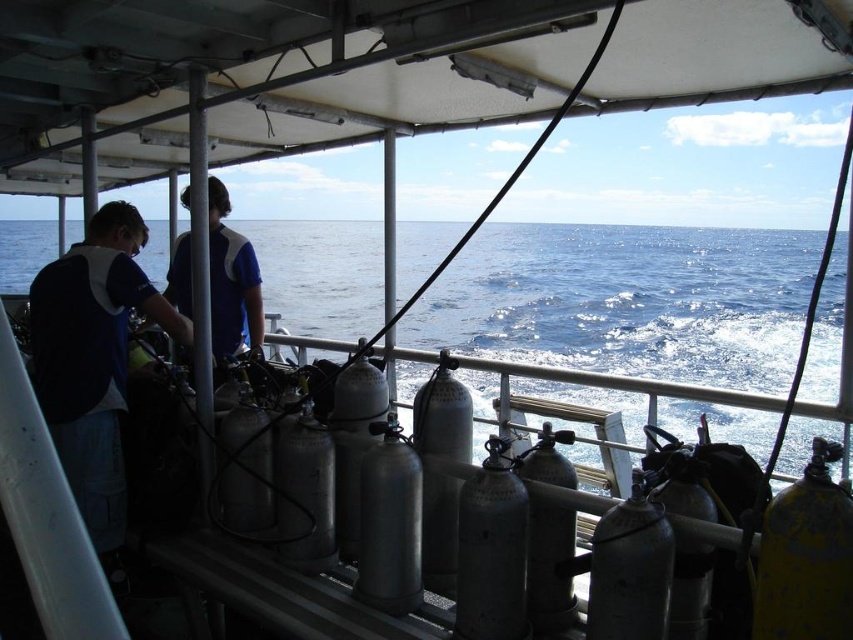
Which is behind, point (762, 452) or point (111, 291)?

Positioned behind is point (762, 452).

This screenshot has height=640, width=853. What do you see at coordinates (625, 301) in the screenshot?
I see `metallic silver water at lower center` at bounding box center [625, 301].

This screenshot has height=640, width=853. I want to click on metallic silver water at lower center, so click(625, 301).

This screenshot has height=640, width=853. In order to click on metallic silver water at lower center in this screenshot , I will do `click(625, 301)`.

Is metallic silver water at lower center thinner than blue fabric shirt at center?

In fact, metallic silver water at lower center might be wider than blue fabric shirt at center.

Does metallic silver water at lower center have a larger size compared to blue fabric shirt at center?

Indeed, metallic silver water at lower center has a larger size compared to blue fabric shirt at center.

Which is in front, point (281, 276) or point (173, 266)?

Point (173, 266) is in front.

At what (x,y) coordinates should I click in order to perform the action: click on metallic silver water at lower center. Please return your answer as a coordinate pair (x, y). Looking at the image, I should click on (625, 301).

Can you confirm if dark blue shirt at left is bigger than blue fabric shirt at center?

Incorrect, dark blue shirt at left is not larger than blue fabric shirt at center.

Identify the location of dark blue shirt at left. (94, 362).

Does point (74, 438) come in front of point (218, 193)?

Yes.

Find the location of a particular element. The width and height of the screenshot is (853, 640). dark blue shirt at left is located at coordinates 94,362.